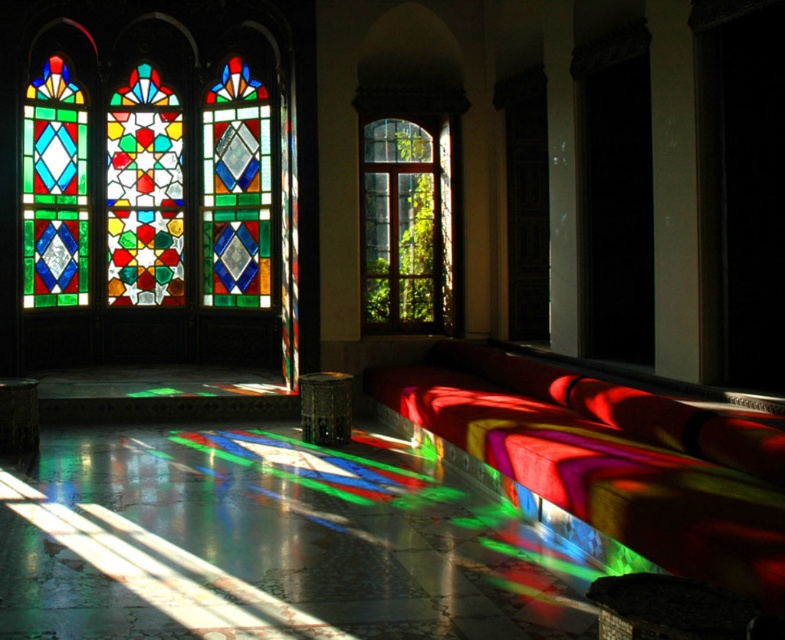
From the picture: You are an interior designer planning to place a new rectangular rug in this room. The rug must be placed between the stained glass window at upper left and the velvet red bench at center. Considering their widths, which object should the rug be wider than to ensure it covers the entire space between them?

The rug should be wider than the stained glass window at upper left because its width surpasses that of the velvet red bench at center, so the rug needs to match the wider dimension to cover the space between them.

You are planning to place a large potted plant in the center of the room. The velvet red bench at center and the clear glass window at center are already there. Which object should you move to make space for the plant?

The velvet red bench at center is bigger than the clear glass window at center, so you should move the clear glass window at center to make space for the plant.